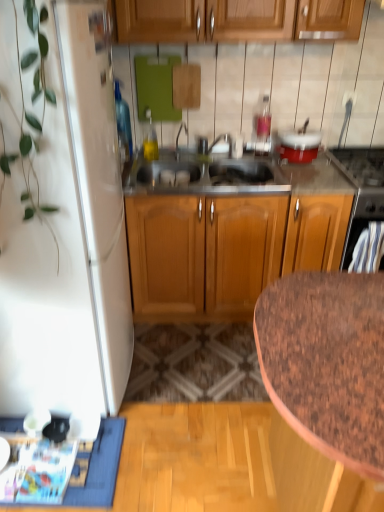
Describe the element at coordinates (68, 242) in the screenshot. I see `white matte refrigerator at left` at that location.

What do you see at coordinates (361, 189) in the screenshot? Image resolution: width=384 pixels, height=512 pixels. I see `black glass stove at upper right, which ranks as the 1th appliance in right-to-left order` at bounding box center [361, 189].

Locate an element on the screen. The image size is (384, 512). brown speckled granite at lower right is located at coordinates (327, 362).

Is blue fabric doormat at lower left to the left or to the right of brown speckled granite at lower right in the image?

blue fabric doormat at lower left is positioned on brown speckled granite at lower right's left side.

Which point is more distant from viewer, (89, 482) or (255, 317)?

The point (89, 482) is farther.

Measure the distance between blue fabric doormat at lower left and brown speckled granite at lower right.

blue fabric doormat at lower left is 1.06 meters away from brown speckled granite at lower right.

Is blue fabric doormat at lower left wider or thinner than brown speckled granite at lower right?

In the image, blue fabric doormat at lower left appears to be more narrow than brown speckled granite at lower right.

Would you consider red glossy pot at upper right, which is the 1th appliance in left-to-right order, to be distant from brown speckled granite at lower right?

That's right, there is a large distance between red glossy pot at upper right, which is the 1th appliance in left-to-right order, and brown speckled granite at lower right.

Does red glossy pot at upper right, which ranks as the 2th appliance in right-to-left order, have a greater height compared to brown speckled granite at lower right?

In fact, red glossy pot at upper right, which ranks as the 2th appliance in right-to-left order, may be shorter than brown speckled granite at lower right.

From the image's perspective, is red glossy pot at upper right, which is the 1th appliance in left-to-right order, located beneath brown speckled granite at lower right?

Actually, red glossy pot at upper right, which is the 1th appliance in left-to-right order, appears above brown speckled granite at lower right in the image.

Looking at this image, how much distance is there between red glossy pot at upper right, which is the 1th appliance in left-to-right order, and brown speckled granite at lower right?

The distance of red glossy pot at upper right, which is the 1th appliance in left-to-right order, from brown speckled granite at lower right is 4.41 feet.

Is blue fabric doormat at lower left oriented towards red glossy pot at upper right, which ranks as the 2th appliance in right-to-left order?

No, blue fabric doormat at lower left is not facing towards red glossy pot at upper right, which ranks as the 2th appliance in right-to-left order.

Measure the distance between blue fabric doormat at lower left and red glossy pot at upper right, which is the 1th appliance in left-to-right order.

They are 1.69 meters apart.

From a real-world perspective, which object rests below the other?

blue fabric doormat at lower left, from a real-world perspective.

Which of these two, blue fabric doormat at lower left or red glossy pot at upper right, which is the 1th appliance in left-to-right order, is smaller?

Smaller between the two is blue fabric doormat at lower left.

Could you tell me if brown speckled granite at lower right is turned towards blue fabric doormat at lower left?

No, brown speckled granite at lower right is not aimed at blue fabric doormat at lower left.

What's the angular difference between brown speckled granite at lower right and blue fabric doormat at lower left's facing directions?

There is a 90.2-degree angle between the facing directions of brown speckled granite at lower right and blue fabric doormat at lower left.

Is point (366, 464) closer or farther from the camera than point (107, 423)?

Point (366, 464) appears to be closer to the viewer than point (107, 423).

Locate an element on the screen. doormat located on the left of brown speckled granite at lower right is located at coordinates (101, 468).

Considering the positions of objects white matte refrigerator at left and black glass stove at upper right, positioned as the 2th appliance in left-to-right order, in the image provided, who is more to the left, white matte refrigerator at left or black glass stove at upper right, positioned as the 2th appliance in left-to-right order,?

From the viewer's perspective, white matte refrigerator at left appears more on the left side.

Between white matte refrigerator at left and black glass stove at upper right, which ranks as the 1th appliance in right-to-left order, which one has smaller size?

black glass stove at upper right, which ranks as the 1th appliance in right-to-left order.

Is white matte refrigerator at left thinner than black glass stove at upper right, which ranks as the 1th appliance in right-to-left order?

Incorrect, the width of white matte refrigerator at left is not less than that of black glass stove at upper right, which ranks as the 1th appliance in right-to-left order.

In the image, is white matte refrigerator at left positioned in front of or behind black glass stove at upper right, positioned as the 2th appliance in left-to-right order?

white matte refrigerator at left is positioned closer to the viewer than black glass stove at upper right, positioned as the 2th appliance in left-to-right order.

Locate an element on the screen. the 1st appliance behind the brown speckled granite at lower right is located at coordinates (361, 189).

Which is in front, brown speckled granite at lower right or black glass stove at upper right, positioned as the 2th appliance in left-to-right order?

brown speckled granite at lower right is more forward.

Can you confirm if brown speckled granite at lower right is smaller than black glass stove at upper right, which ranks as the 1th appliance in right-to-left order?

Incorrect, brown speckled granite at lower right is not smaller in size than black glass stove at upper right, which ranks as the 1th appliance in right-to-left order.

Is point (382, 402) positioned after point (346, 162)?

No, (382, 402) is closer to viewer.

Between red glossy pot at upper right, which is the 1th appliance in left-to-right order, and white matte refrigerator at left, which one has smaller size?

red glossy pot at upper right, which is the 1th appliance in left-to-right order.

Is red glossy pot at upper right, which ranks as the 2th appliance in right-to-left order, behind white matte refrigerator at left?

Yes, it is.

What's the angular difference between red glossy pot at upper right, which is the 1th appliance in left-to-right order, and white matte refrigerator at left's facing directions?

The angular difference between red glossy pot at upper right, which is the 1th appliance in left-to-right order, and white matte refrigerator at left is 89.8 degrees.

Could you tell me if red glossy pot at upper right, which ranks as the 2th appliance in right-to-left order, is facing white matte refrigerator at left?

No, red glossy pot at upper right, which ranks as the 2th appliance in right-to-left order, is not aimed at white matte refrigerator at left.

In the image, there is a brown speckled granite at lower right. Where is `doormat below it (from a real-world perspective)`? The height and width of the screenshot is (512, 384). doormat below it (from a real-world perspective) is located at coordinates (101, 468).

From the brown speckled granite at lower right, count 1st appliance to the right and point to it. Please provide its 2D coordinates.

[(299, 146)]

From the image, which object appears to be nearer to blue fabric doormat at lower left, red glossy pot at upper right, which is the 1th appliance in left-to-right order, or brown speckled granite at lower right?

brown speckled granite at lower right is closer to blue fabric doormat at lower left.

Based on their spatial positions, is brown speckled granite at lower right or blue fabric doormat at lower left further from red glossy pot at upper right, which is the 1th appliance in left-to-right order?

blue fabric doormat at lower left lies further to red glossy pot at upper right, which is the 1th appliance in left-to-right order, than the other object.

When comparing their distances from brown speckled granite at lower right, does white matte refrigerator at left or red glossy pot at upper right, which ranks as the 2th appliance in right-to-left order, seem closer?

white matte refrigerator at left.

Considering their positions, is black glass stove at upper right, positioned as the 2th appliance in left-to-right order, positioned closer to brown speckled granite at lower right than red glossy pot at upper right, which is the 1th appliance in left-to-right order?

Among the two, black glass stove at upper right, positioned as the 2th appliance in left-to-right order, is located nearer to brown speckled granite at lower right.

Looking at the image, which one is located closer to black glass stove at upper right, positioned as the 2th appliance in left-to-right order, brown speckled granite at lower right or red glossy pot at upper right, which is the 1th appliance in left-to-right order?

red glossy pot at upper right, which is the 1th appliance in left-to-right order, is closer to black glass stove at upper right, positioned as the 2th appliance in left-to-right order.

Estimate the real-world distances between objects in this image. Which object is closer to blue fabric doormat at lower left, white matte refrigerator at left or black glass stove at upper right, which ranks as the 1th appliance in right-to-left order?

Based on the image, white matte refrigerator at left appears to be nearer to blue fabric doormat at lower left.

Based on their spatial positions, is white matte refrigerator at left or blue fabric doormat at lower left further from red glossy pot at upper right, which ranks as the 2th appliance in right-to-left order?

The object further to red glossy pot at upper right, which ranks as the 2th appliance in right-to-left order, is blue fabric doormat at lower left.

From the image, which object appears to be nearer to white matte refrigerator at left, blue fabric doormat at lower left or red glossy pot at upper right, which is the 1th appliance in left-to-right order?

blue fabric doormat at lower left is closer to white matte refrigerator at left.

The image size is (384, 512). I want to click on refrigerator between brown speckled granite at lower right and red glossy pot at upper right, which ranks as the 2th appliance in right-to-left order, from front to back, so click(x=68, y=242).

Where is `countertop between blue fabric doormat at lower left and black glass stove at upper right, which ranks as the 1th appliance in right-to-left order`? countertop between blue fabric doormat at lower left and black glass stove at upper right, which ranks as the 1th appliance in right-to-left order is located at coordinates (327, 362).

This screenshot has height=512, width=384. I want to click on appliance between white matte refrigerator at left and black glass stove at upper right, positioned as the 2th appliance in left-to-right order, from left to right, so click(299, 146).

I want to click on appliance between blue fabric doormat at lower left and black glass stove at upper right, positioned as the 2th appliance in left-to-right order, in the horizontal direction, so click(x=299, y=146).